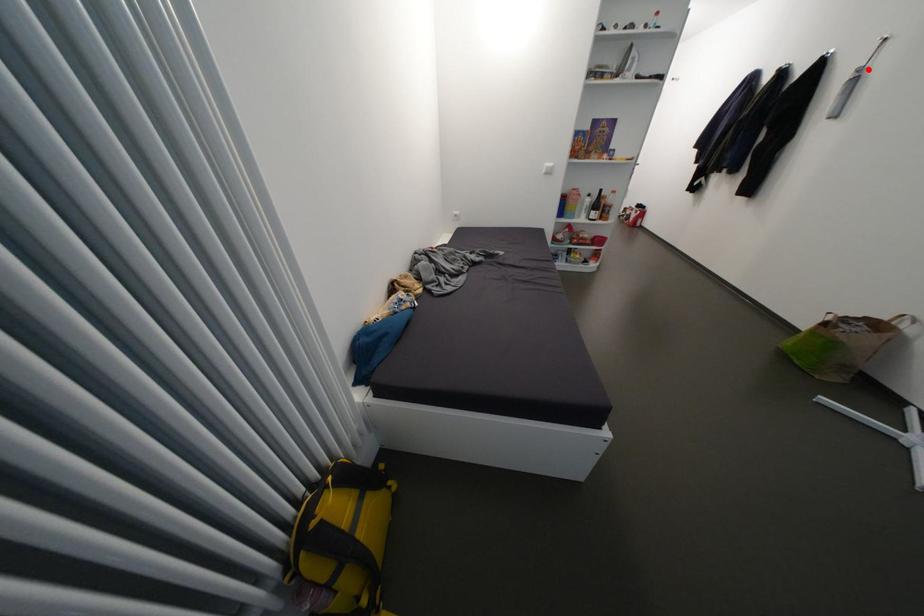
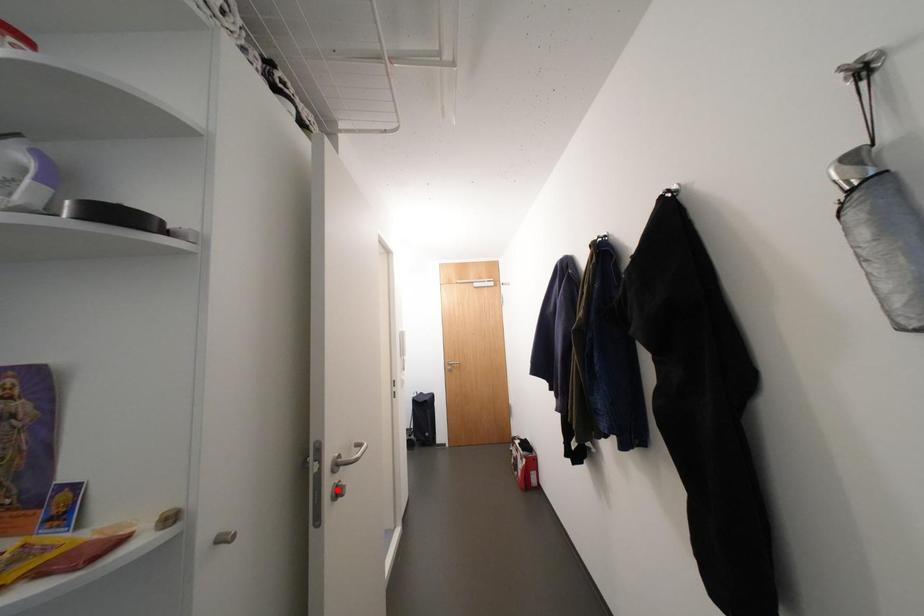
I am providing you with two images of the same scene from different viewpoints. A red point is marked on the first image and another point is marked on the second image. Are the points marked in image1 and image2 representing the same 3D position?

No